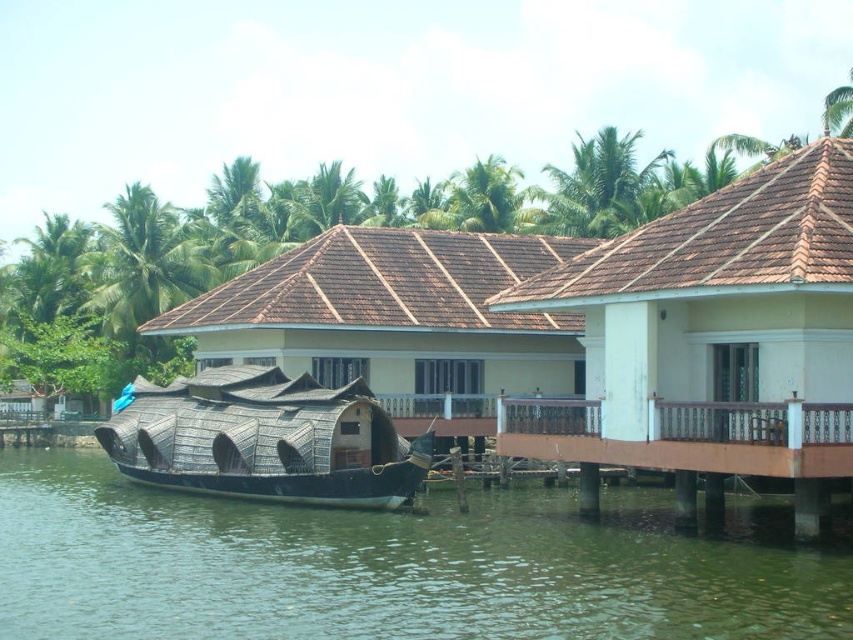
Can you confirm if green water at lower left is positioned to the right of rattan-thatched hut at center?

Incorrect, green water at lower left is not on the right side of rattan-thatched hut at center.

Does green water at lower left appear under rattan-thatched hut at center?

Yes.

I want to click on green water at lower left, so click(x=393, y=566).

Identify the location of green water at lower left. (393, 566).

Is green water at lower left bigger than white painted wood house at center?

Actually, green water at lower left might be smaller than white painted wood house at center.

Where is `green water at lower left`? green water at lower left is located at coordinates (393, 566).

Consider the image. Can you confirm if rattan-thatched hut at center is thinner than black woven boat at center?

In fact, rattan-thatched hut at center might be wider than black woven boat at center.

In the scene shown: Is the position of rattan-thatched hut at center more distant than that of black woven boat at center?

Yes, rattan-thatched hut at center is further from the viewer.

Does point (347, 342) lie in front of point (207, 435)?

No, it is not.

Image resolution: width=853 pixels, height=640 pixels. I want to click on rattan-thatched hut at center, so click(396, 321).